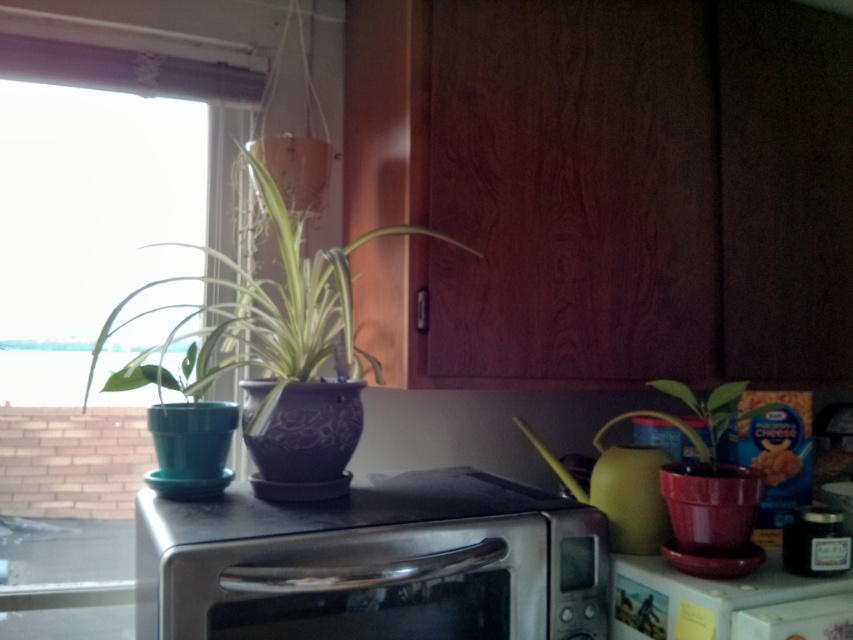
You are a delivery person who needs to place a new microwave that is 36 inches wide into the kitchen. Based on the scene, can you fit the microwave in the same position as the satin silver microwave at center without moving any other items?

The satin silver microwave at center is currently 34.10 inches away from the camera. Since the new microwave is 36 inches wide, it is 1.9 inches wider than the existing one. This might not leave enough space between the new microwave and nearby items like the potted plants and the watering can, so it may not fit without adjustments.

You are organizing the kitchen shelves and need to stack the satin silver microwave at center and the matte purple pot at left vertically. Which one should you place at the bottom to ensure stability?

The satin silver microwave at center has a lesser height compared to matte purple pot at left, so placing the taller matte purple pot at left at the bottom would provide better stability due to its height and weight distribution.